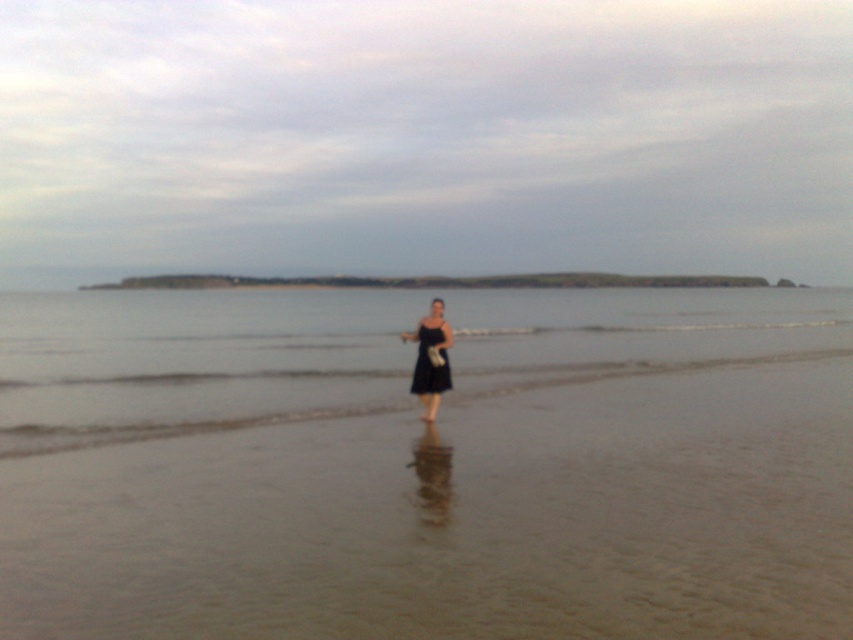
Between black matte dress at center and black satin dress at center, which one has more height?

With more height is black matte dress at center.

Who is more distant from viewer, (422, 392) or (450, 376)?

Point (422, 392)

Measure the distance between point (416, 394) and camera.

A distance of 13.34 meters exists between point (416, 394) and camera.

Find the location of a particular element. black matte dress at center is located at coordinates (428, 358).

Is point (462, 570) positioned in front of point (123, 376)?

Yes, it is.

Does brown sandy beach at center have a larger size compared to clear water at center?

Actually, brown sandy beach at center might be smaller than clear water at center.

Between point (792, 500) and point (132, 433), which one is positioned behind?

The point (132, 433) is behind.

The width and height of the screenshot is (853, 640). I want to click on brown sandy beach at center, so click(457, 518).

Does clear water at center have a greater width compared to black satin dress at center?

Yes.

Is point (682, 340) behind point (450, 376)?

Yes.

Locate an element on the screen. This screenshot has width=853, height=640. clear water at center is located at coordinates tap(195, 362).